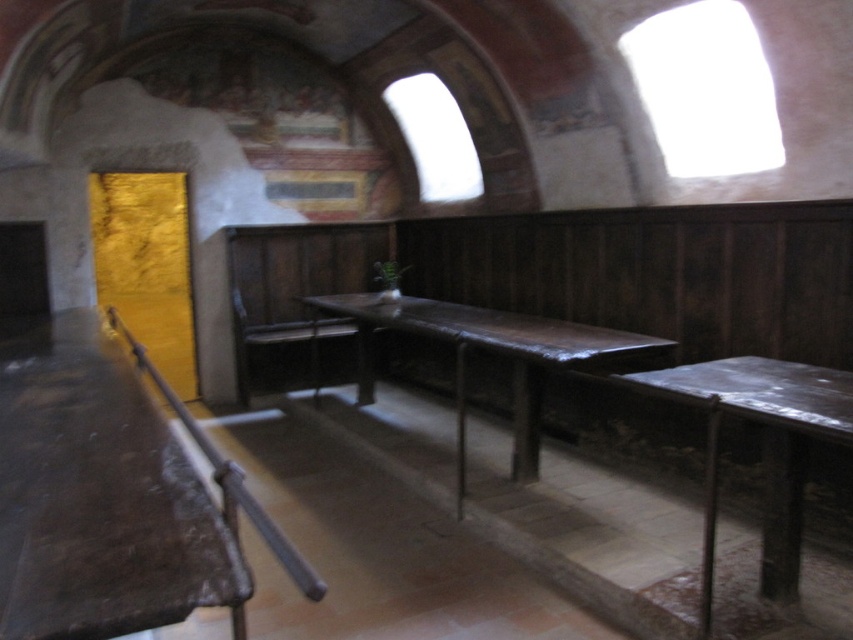
Question: Which object appears closest to the camera in this image?

Choices:
 (A) dark brown wooden table at left
 (B) rustic wood table at center
 (C) rustic wood table at lower right

Answer: (A)

Question: Considering the relative positions of dark brown wooden table at left and rustic wood table at center in the image provided, where is dark brown wooden table at left located with respect to rustic wood table at center?

Choices:
 (A) above
 (B) below

Answer: (B)

Question: Is dark brown wooden table at left thinner than rustic wood table at center?

Choices:
 (A) yes
 (B) no

Answer: (A)

Question: Estimate the real-world distances between objects in this image. Which object is closer to the rustic wood table at lower right?

Choices:
 (A) rustic wood table at center
 (B) dark brown wooden table at left

Answer: (A)

Question: Is dark brown wooden table at left closer to the viewer compared to rustic wood table at lower right?

Choices:
 (A) no
 (B) yes

Answer: (B)

Question: Which point is closer to the camera?

Choices:
 (A) rustic wood table at center
 (B) rustic wood table at lower right
 (C) dark brown wooden table at left

Answer: (C)